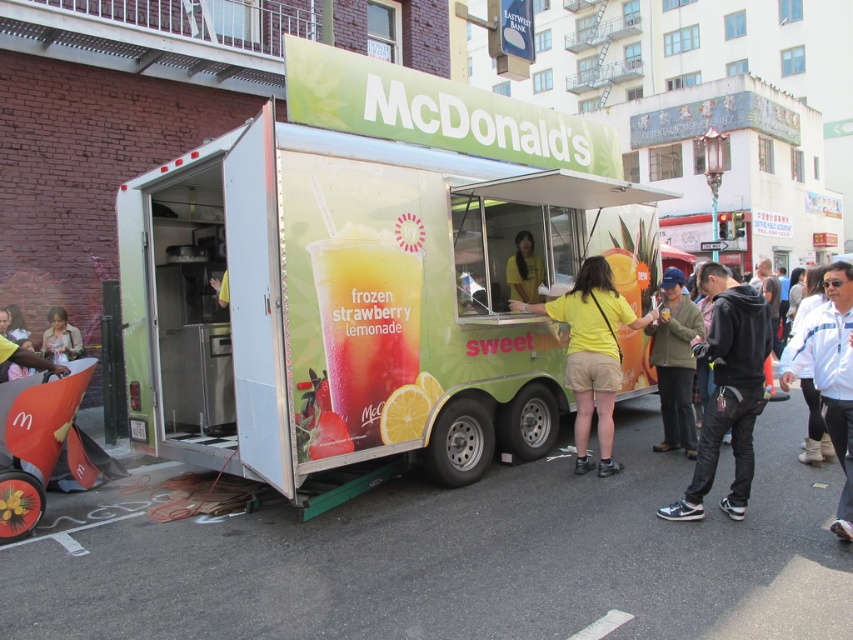
Which is above, white jacket at lower right or green textured jacket at center?

green textured jacket at center

Between white jacket at lower right and green textured jacket at center, which one has more height?

green textured jacket at center

Which is in front, point (834, 337) or point (654, 324)?

Point (834, 337)

Identify the location of white jacket at lower right. (830, 374).

Can you confirm if translucent plastic cup at center is bigger than white jacket at lower right?

No.

Is point (393, 368) closer to viewer compared to point (833, 284)?

No, it is not.

Where is `translucent plastic cup at center`? Image resolution: width=853 pixels, height=640 pixels. translucent plastic cup at center is located at coordinates [x=366, y=337].

Is black leather jacket at lower right bigger than green textured jacket at center?

Yes, black leather jacket at lower right is bigger than green textured jacket at center.

From the picture: Is black leather jacket at lower right closer to the viewer compared to green textured jacket at center?

Yes, it is in front of green textured jacket at center.

Is point (758, 307) positioned in front of point (671, 298)?

Yes, point (758, 307) is closer to viewer.

I want to click on black leather jacket at lower right, so click(x=727, y=390).